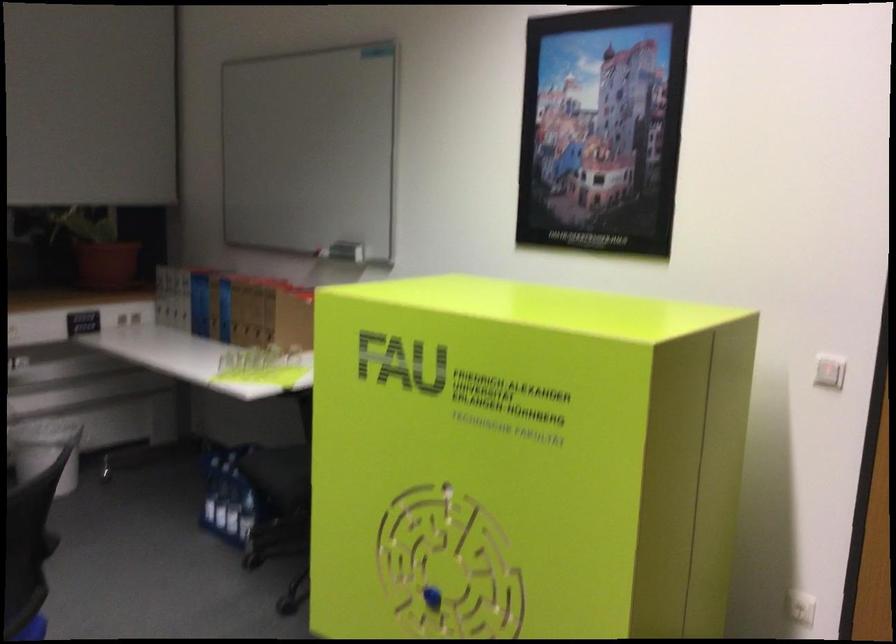
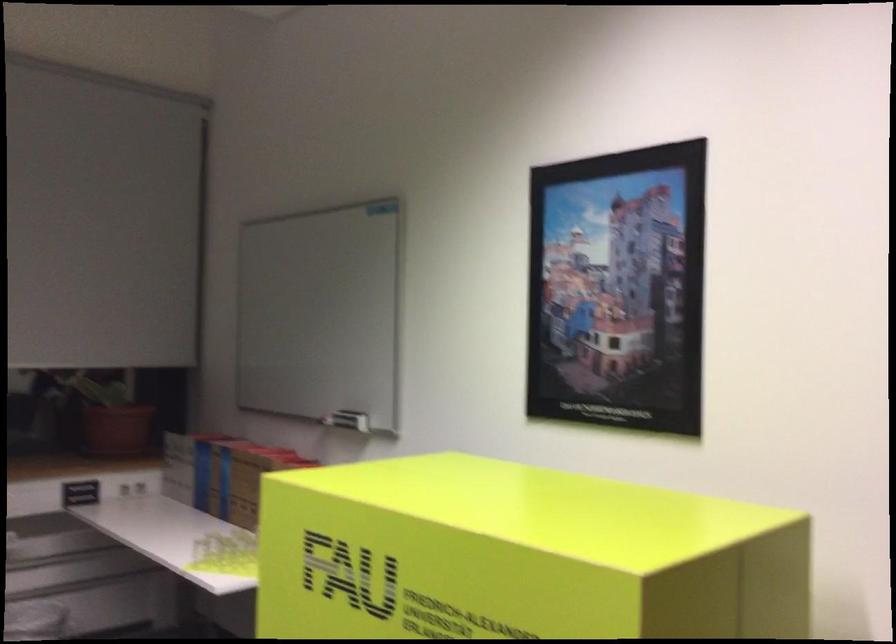
In a continuous first-person perspective shot, in which direction is the camera moving?

The movement direction of the cameraman is right, forward.